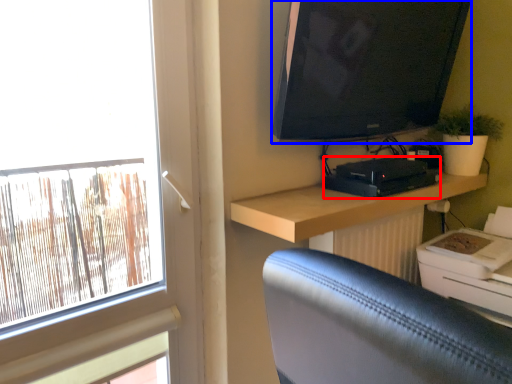
Question: Which object appears farthest to the camera in this image, equipment (highlighted by a red box) or television (highlighted by a blue box)?

Choices:
 (A) equipment
 (B) television

Answer: (A)